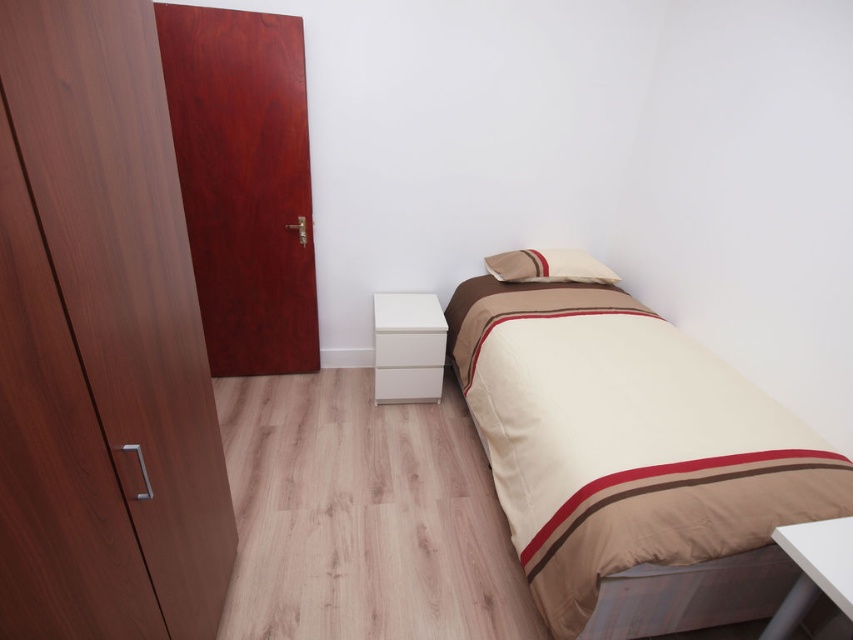
You are organizing the bedroom and need to move the white matte drawer at center. Since the beige fabric bed at right is in the way, can you slide the drawer out from under it?

The beige fabric bed at right is positioned over the white matte drawer at center, so you cannot slide the drawer out from under it without moving the bed first.

You are a delivery person trying to place a package between the beige soft pillow at upper center and the white matte drawer at lower center. The package is 26 inches long. Can you fit it between them without tilting?

The distance between the beige soft pillow at upper center and the white matte drawer at lower center is 25.99 inches, which is slightly less than the package length of 26 inches. Therefore, the package cannot be placed between them without tilting.